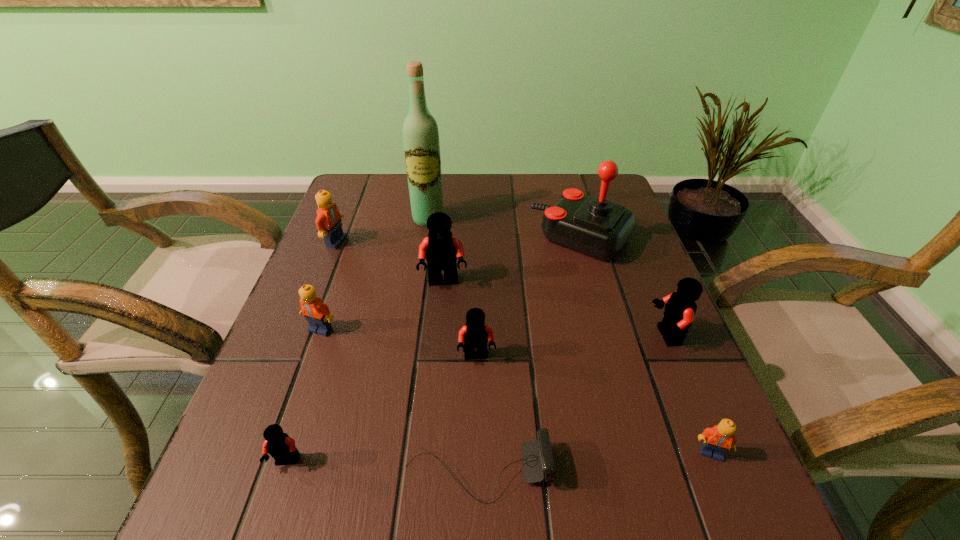
The height and width of the screenshot is (540, 960). In order to click on empty location between the nearest orange Lego and the second nearest orange Lego in this screenshot , I will do `click(516, 391)`.

You are a GUI agent. You are given a task and a screenshot of the screen. Output one action in this format:
    pyautogui.click(x=<x>, y=<y>)
    Task: Click on the vacant region between the farthest orange Lego and the second smallest orange Lego
    
    Given the screenshot: What is the action you would take?
    pyautogui.click(x=328, y=286)

Image resolution: width=960 pixels, height=540 pixels. I want to click on empty location between the nearest orange Lego and the white wine bottle, so (x=569, y=336).

Locate an element on the screen. free spot between the biggest orange Lego and the second biggest orange Lego is located at coordinates (328, 286).

I want to click on blank region between the joystick and the farthest Lego, so click(459, 240).

Find the location of `vacant space that's between the wine bottle and the third biggest black Lego`. vacant space that's between the wine bottle and the third biggest black Lego is located at coordinates (453, 288).

This screenshot has width=960, height=540. Find the location of `free space between the white wine bottle and the webcam`. free space between the white wine bottle and the webcam is located at coordinates (453, 345).

Image resolution: width=960 pixels, height=540 pixels. What are the coordinates of `object identified as the third closest to the second biggest black Lego` in the screenshot? It's located at click(537, 459).

Identify the location of object that is the closest one to the third biggest black Lego. This screenshot has height=540, width=960. (537, 459).

Identify the location of Lego identified as the closest to the second biggest black Lego. This screenshot has width=960, height=540. (718, 440).